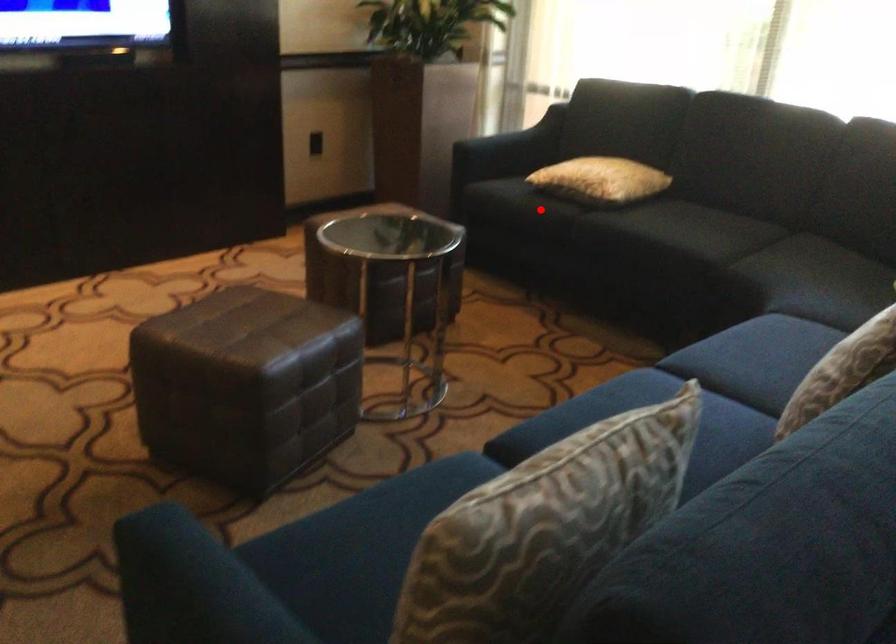
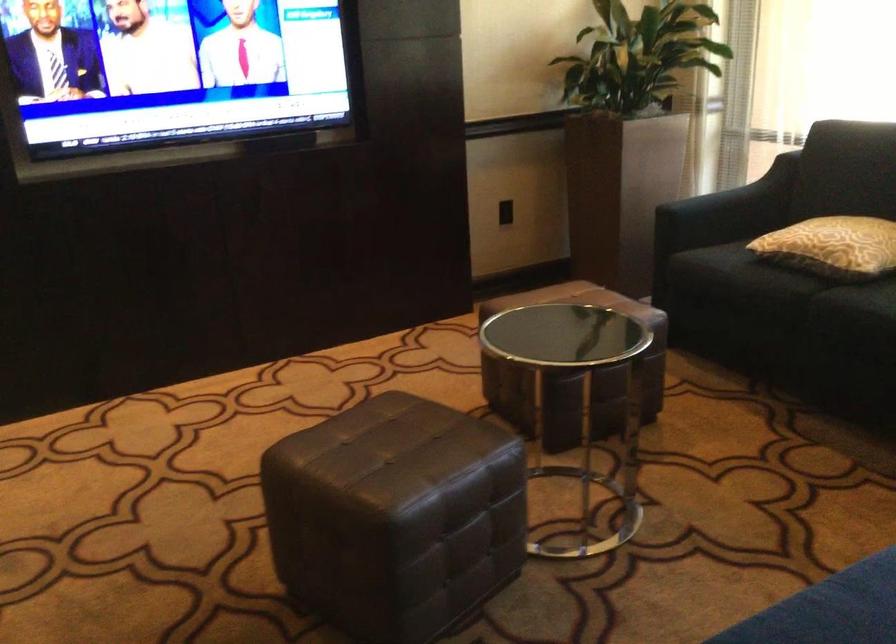
Question: I am providing you with two images of the same scene from different viewpoints. Image1 has a red point marked. In image2, the corresponding 3D location appears at what relative position? Reply with the corresponding letter.

Choices:
 (A) Closer
 (B) Farther

Answer: (A)